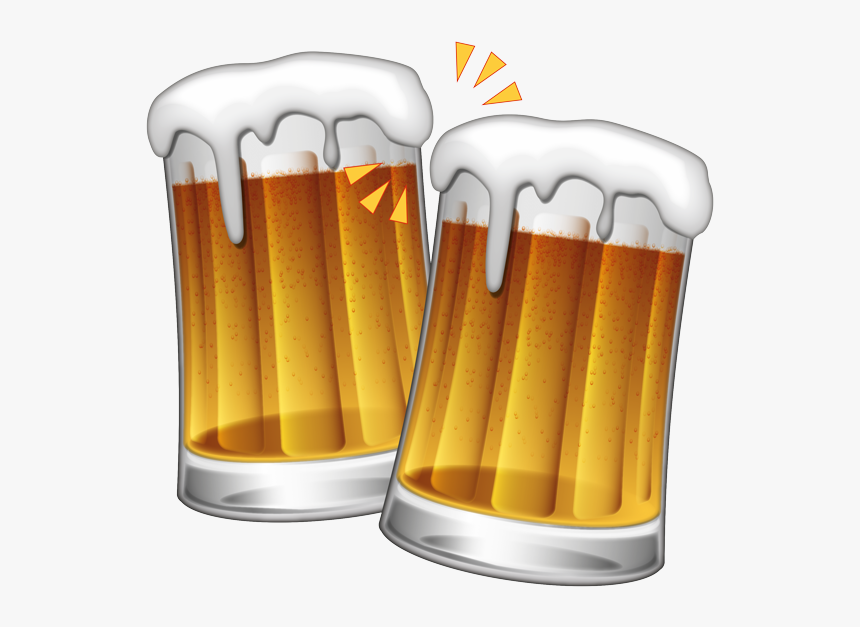
Image resolution: width=860 pixels, height=627 pixels. I want to click on bottom of driking glass, so click(x=551, y=579).